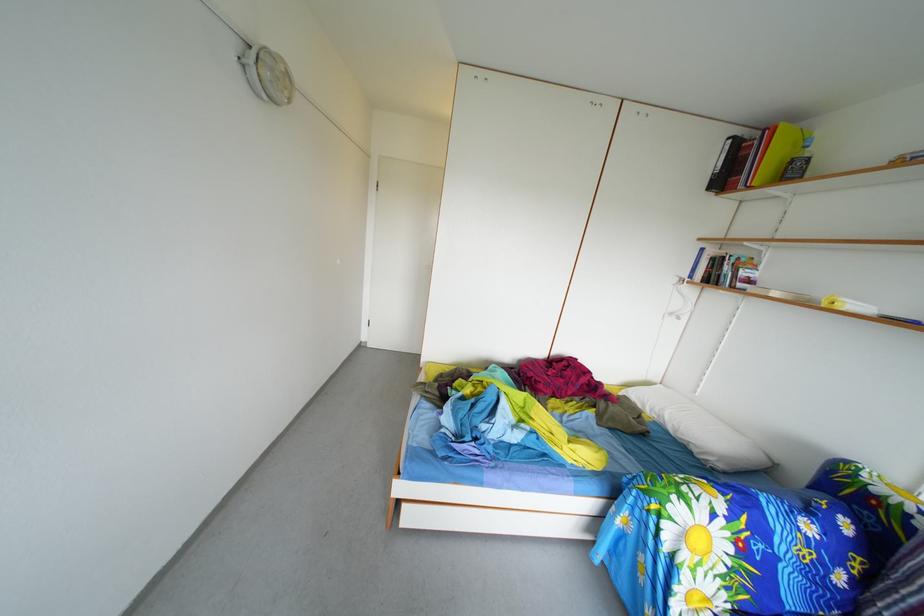
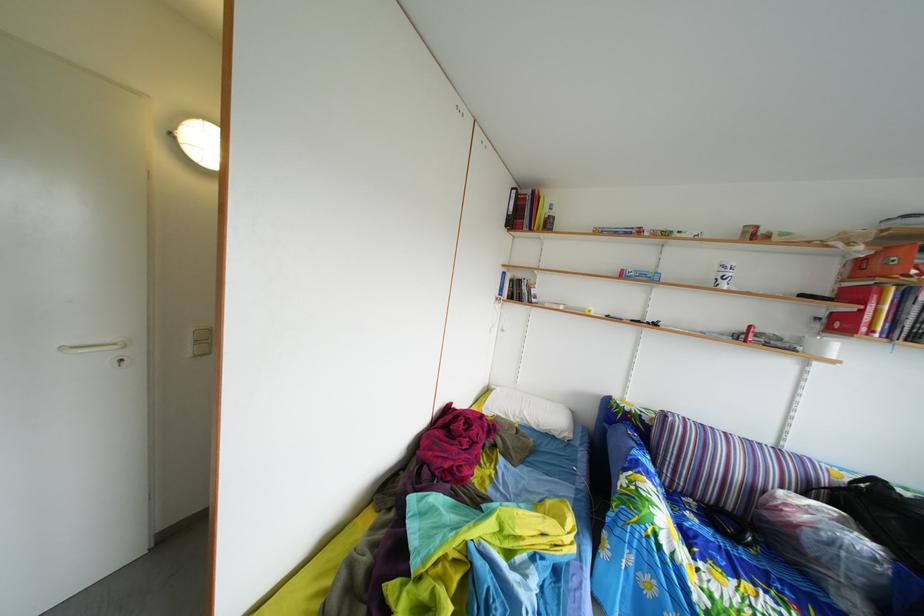
Where in the second image is the point corresponding to pixel 687 440 from the first image?

(549, 434)